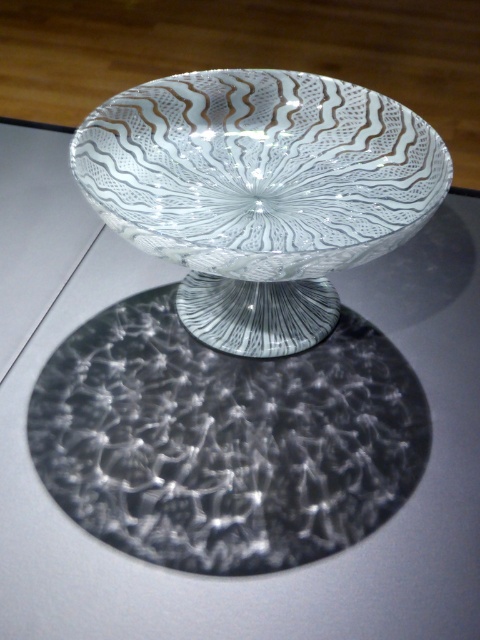
Is transparent textured glass plate at center shorter than transparent glass bowl at center?

Indeed, transparent textured glass plate at center has a lesser height compared to transparent glass bowl at center.

Which is in front, point (142, 483) or point (265, 179)?

Point (142, 483) is in front.

I want to click on transparent textured glass plate at center, so click(226, 440).